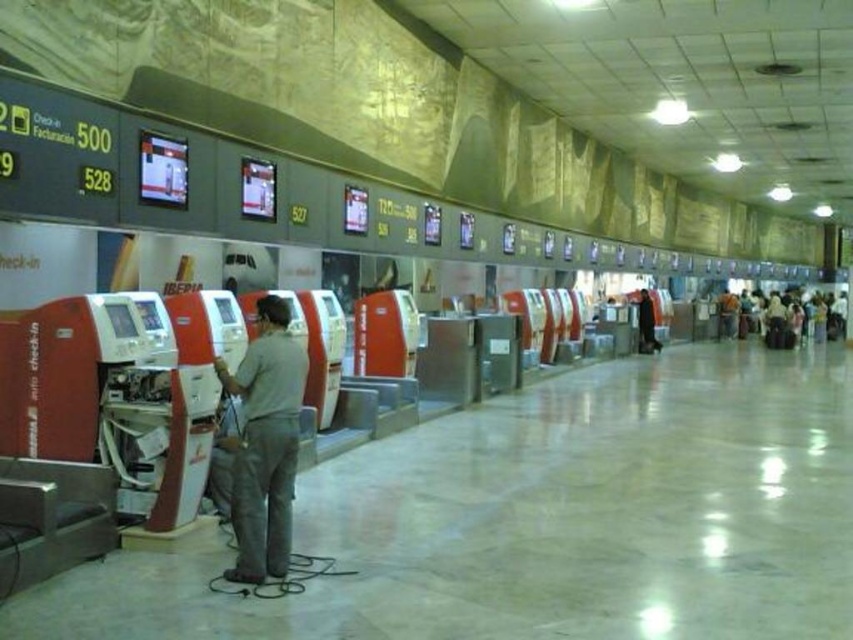
Question: Is the position of gray fabric shirt at center less distant than that of dark fabric coat at center?

Choices:
 (A) yes
 (B) no

Answer: (A)

Question: Does dark fabric coat at center have a lesser width compared to light brown leather jacket at center?

Choices:
 (A) yes
 (B) no

Answer: (A)

Question: Which object is farther from the camera taking this photo?

Choices:
 (A) light brown leather jacket at center
 (B) dark fabric coat at center
 (C) gray fabric shirt at center
 (D) light brown fabric bag at right

Answer: (A)

Question: Which point is closer to the camera?

Choices:
 (A) (779, 340)
 (B) (651, 337)

Answer: (B)

Question: Among these points, which one is nearest to the camera?

Choices:
 (A) (277, 532)
 (B) (654, 346)

Answer: (A)

Question: Does gray fabric shirt at center appear on the left side of light brown leather jacket at center?

Choices:
 (A) no
 (B) yes

Answer: (B)